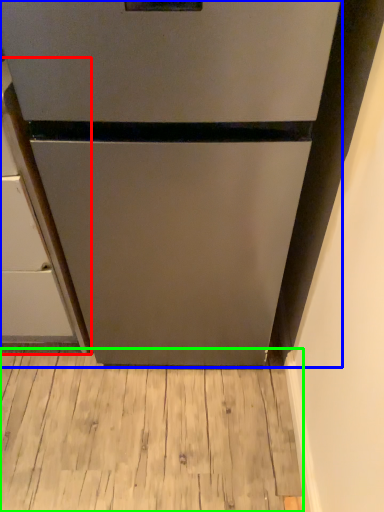
Question: Which object is positioned farthest from cabinetry (highlighted by a red box)? Select from refrigerator (highlighted by a blue box) and hardwood (highlighted by a green box).

Choices:
 (A) refrigerator
 (B) hardwood

Answer: (B)